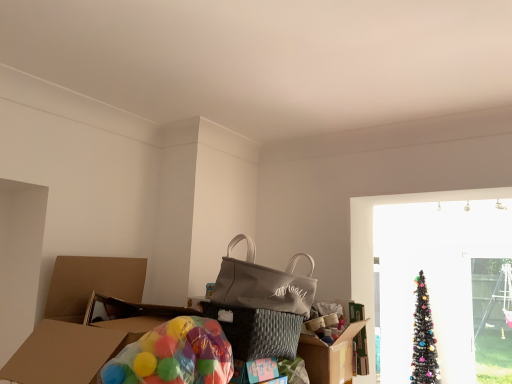
The width and height of the screenshot is (512, 384). What do you see at coordinates (174, 355) in the screenshot?
I see `translucent plastic balloons at lower left` at bounding box center [174, 355].

Describe the element at coordinates (492, 318) in the screenshot. I see `transparent plastic screen door at right` at that location.

The height and width of the screenshot is (384, 512). Find the location of `black glittery christmas tree at right`. black glittery christmas tree at right is located at coordinates (424, 338).

Where is `translucent plastic balloons at lower left`? The width and height of the screenshot is (512, 384). translucent plastic balloons at lower left is located at coordinates (174, 355).

Is black glittery christmas tree at right aimed at translucent plastic balloons at lower left?

Yes.

How different are the orientations of black glittery christmas tree at right and translucent plastic balloons at lower left in degrees?

The angular difference between black glittery christmas tree at right and translucent plastic balloons at lower left is 90 degrees.

Considering the positions of objects black glittery christmas tree at right and translucent plastic balloons at lower left in the image provided, who is more to the left, black glittery christmas tree at right or translucent plastic balloons at lower left?

translucent plastic balloons at lower left is more to the left.

From the image's perspective, which one is positioned lower, black glittery christmas tree at right or translucent plastic balloons at lower left?

black glittery christmas tree at right.

Where is `screen door that is on the right side of black glittery christmas tree at right`? screen door that is on the right side of black glittery christmas tree at right is located at coordinates (492, 318).

Considering the positions of point (429, 368) and point (494, 258), is point (429, 368) closer or farther from the camera than point (494, 258)?

Point (429, 368) appears to be closer to the viewer than point (494, 258).

Who is smaller, black glittery christmas tree at right or transparent plastic screen door at right?

transparent plastic screen door at right is smaller.

Between translucent plastic balloons at lower left and transparent plastic screen door at right, which one has smaller size?

translucent plastic balloons at lower left is smaller.

Which object is thinner, translucent plastic balloons at lower left or transparent plastic screen door at right?

transparent plastic screen door at right is thinner.

From the picture: Considering the sizes of objects translucent plastic balloons at lower left and transparent plastic screen door at right in the image provided, who is taller, translucent plastic balloons at lower left or transparent plastic screen door at right?

transparent plastic screen door at right.

How different are the orientations of translucent plastic balloons at lower left and transparent plastic screen door at right in degrees?

There is a 90-degree angle between the facing directions of translucent plastic balloons at lower left and transparent plastic screen door at right.

Is matte gray tote bag at center inside or outside of transparent plastic screen door at right?

matte gray tote bag at center is outside transparent plastic screen door at right.

Does point (278, 279) come farther from viewer compared to point (494, 312)?

No.

Can you confirm if matte gray tote bag at center is wider than transparent plastic screen door at right?

Correct, the width of matte gray tote bag at center exceeds that of transparent plastic screen door at right.

Does point (154, 366) appear closer or farther from the camera than point (416, 365)?

Point (154, 366) appears to be closer to the viewer than point (416, 365).

Is translucent plastic balloons at lower left with black glittery christmas tree at right?

There is a gap between translucent plastic balloons at lower left and black glittery christmas tree at right.

The image size is (512, 384). What are the coordinates of `balloon in front of the black glittery christmas tree at right` in the screenshot? It's located at (174, 355).

Is translucent plastic balloons at lower left turned away from black glittery christmas tree at right?

translucent plastic balloons at lower left does not have its back to black glittery christmas tree at right.

Identify the location of screen door lying above the black glittery christmas tree at right (from the image's perspective). The image size is (512, 384). (492, 318).

Considering the sizes of objects transparent plastic screen door at right and black glittery christmas tree at right in the image provided, who is taller, transparent plastic screen door at right or black glittery christmas tree at right?

Standing taller between the two is transparent plastic screen door at right.

Measure the distance between transparent plastic screen door at right and black glittery christmas tree at right.

transparent plastic screen door at right is 18.04 inches from black glittery christmas tree at right.

Which object is closer to the camera taking this photo, transparent plastic screen door at right or black glittery christmas tree at right?

black glittery christmas tree at right is closer to the camera.

In the scene shown: From a real-world perspective, which is physically below, matte gray tote bag at center or translucent plastic balloons at lower left?

In real-world perspective, translucent plastic balloons at lower left is lower.

Based on the photo, are matte gray tote bag at center and translucent plastic balloons at lower left far apart?

No, there isn't a large distance between matte gray tote bag at center and translucent plastic balloons at lower left.

Which is more to the left, matte gray tote bag at center or translucent plastic balloons at lower left?

Positioned to the left is translucent plastic balloons at lower left.

Identify the location of balloon located in front of the black glittery christmas tree at right. The height and width of the screenshot is (384, 512). (174, 355).

Image resolution: width=512 pixels, height=384 pixels. I want to click on screen door above the black glittery christmas tree at right (from a real-world perspective), so click(492, 318).

Estimate the real-world distances between objects in this image. Which object is further from matte gray tote bag at center, black glittery christmas tree at right or transparent plastic screen door at right?

The object further to matte gray tote bag at center is transparent plastic screen door at right.

Based on the photo, looking at the image, which one is located closer to transparent plastic screen door at right, matte gray tote bag at center or translucent plastic balloons at lower left?

matte gray tote bag at center.

Considering their positions, is translucent plastic balloons at lower left positioned further to matte gray tote bag at center than transparent plastic screen door at right?

transparent plastic screen door at right lies further to matte gray tote bag at center than the other object.

Looking at this image, from the image, which object appears to be farther from translucent plastic balloons at lower left, matte gray tote bag at center or black glittery christmas tree at right?

The object further to translucent plastic balloons at lower left is black glittery christmas tree at right.

When comparing their distances from transparent plastic screen door at right, does black glittery christmas tree at right or matte gray tote bag at center seem closer?

black glittery christmas tree at right.

Estimate the real-world distances between objects in this image. Which object is closer to translucent plastic balloons at lower left, black glittery christmas tree at right or matte gray tote bag at center?

matte gray tote bag at center is closer to translucent plastic balloons at lower left.

When comparing their distances from translucent plastic balloons at lower left, does black glittery christmas tree at right or transparent plastic screen door at right seem closer?

black glittery christmas tree at right lies closer to translucent plastic balloons at lower left than the other object.

In the scene shown: Estimate the real-world distances between objects in this image. Which object is closer to transparent plastic screen door at right, black glittery christmas tree at right or translucent plastic balloons at lower left?

Based on the image, black glittery christmas tree at right appears to be nearer to transparent plastic screen door at right.

Identify the location of pack located between translucent plastic balloons at lower left and transparent plastic screen door at right in the depth direction. The width and height of the screenshot is (512, 384). (263, 283).

At what (x,y) coordinates should I click in order to perform the action: click on christmas tree between matte gray tote bag at center and transparent plastic screen door at right in the front-back direction. Please return your answer as a coordinate pair (x, y). Looking at the image, I should click on (424, 338).

The image size is (512, 384). What are the coordinates of `pack between translucent plastic balloons at lower left and black glittery christmas tree at right in the front-back direction` in the screenshot? It's located at (263, 283).

Where is `christmas tree between translucent plastic balloons at lower left and transparent plastic screen door at right along the z-axis`? christmas tree between translucent plastic balloons at lower left and transparent plastic screen door at right along the z-axis is located at coordinates (424, 338).